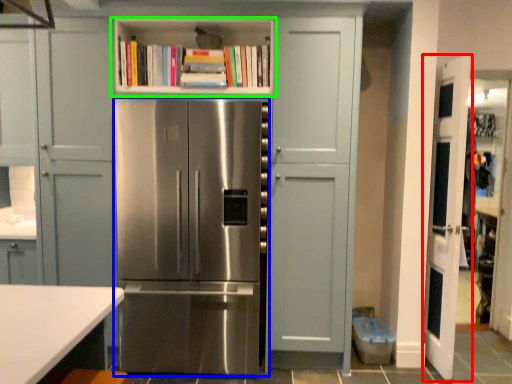
Question: Which object is positioned farthest from door (highlighted by a red box)? Select from refrigerator (highlighted by a blue box) and shelf (highlighted by a green box).

Choices:
 (A) refrigerator
 (B) shelf

Answer: (B)